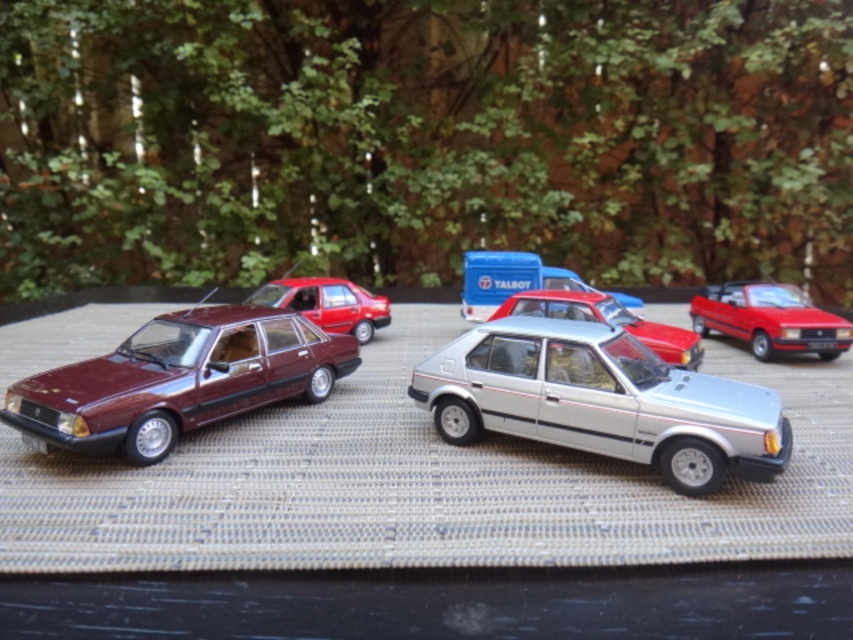
Question: Which point appears farthest from the camera in this image?

Choices:
 (A) (370, 316)
 (B) (352, 356)
 (C) (560, 296)

Answer: (A)

Question: Which point is closer to the camera?

Choices:
 (A) glossy red sedan at center
 (B) satin silver sedan at center
 (C) maroon metallic sedan at left

Answer: (C)

Question: Estimate the real-world distances between objects in this image. Which object is closer to the shiny red car at center?

Choices:
 (A) silver metallic hatchback at center
 (B) glossy red sedan at center
 (C) maroon metallic sedan at left

Answer: (A)

Question: Is shiny red car at center to the left of glossy red sedan at center from the viewer's perspective?

Choices:
 (A) yes
 (B) no

Answer: (B)

Question: Does silver metallic hatchback at center have a lesser width compared to glossy red sedan at center?

Choices:
 (A) no
 (B) yes

Answer: (A)

Question: From the image, what is the correct spatial relationship of silver metallic hatchback at center in relation to shiny red car at center?

Choices:
 (A) below
 (B) above

Answer: (A)